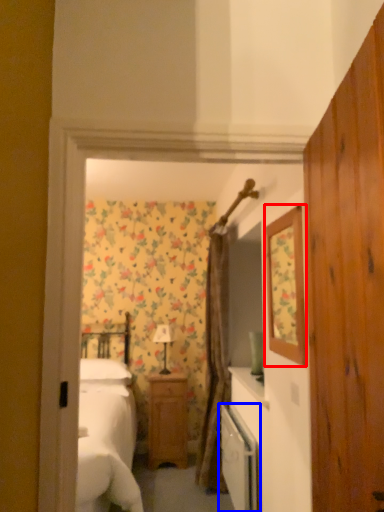
Question: Which object appears closest to the camera in this image, mirror (highlighted by a red box) or dish washer (highlighted by a blue box)?

Choices:
 (A) mirror
 (B) dish washer

Answer: (A)